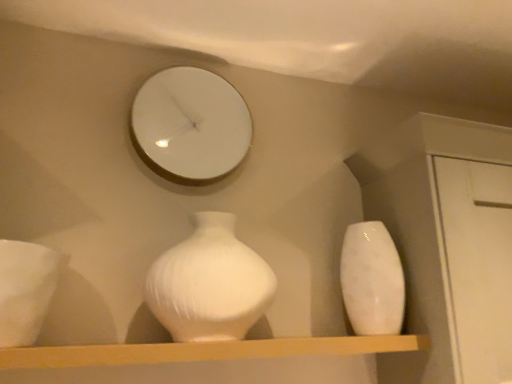
Question: Does smooth wooden shelf at center come behind white glossy vase at right, the second vase viewed from the left?

Choices:
 (A) no
 (B) yes

Answer: (A)

Question: Is smooth wooden shelf at center next to white glossy vase at right, the 1th vase positioned from the right?

Choices:
 (A) no
 (B) yes

Answer: (A)

Question: Is smooth wooden shelf at center facing towards white glossy vase at right, the second vase viewed from the left?

Choices:
 (A) yes
 (B) no

Answer: (B)

Question: From the image's perspective, is smooth wooden shelf at center under white glossy vase at right, the second vase viewed from the left?

Choices:
 (A) yes
 (B) no

Answer: (A)

Question: Is smooth wooden shelf at center outside of white glossy vase at right, the 1th vase positioned from the right?

Choices:
 (A) yes
 (B) no

Answer: (A)

Question: From the image's perspective, is smooth wooden shelf at center on top of white glossy vase at right, the second vase viewed from the left?

Choices:
 (A) yes
 (B) no

Answer: (B)

Question: Is white glossy vase at left not close to white glossy vase at center, marked as the 2th vase in a right-to-left arrangement?

Choices:
 (A) yes
 (B) no

Answer: (B)

Question: Is white glossy vase at left at the left side of white glossy vase at center, arranged as the 1th vase when viewed from the left?

Choices:
 (A) no
 (B) yes

Answer: (B)

Question: Is white glossy vase at left at the right side of white glossy vase at center, arranged as the 1th vase when viewed from the left?

Choices:
 (A) no
 (B) yes

Answer: (A)

Question: From a real-world perspective, is white glossy vase at left under white glossy vase at center, arranged as the 1th vase when viewed from the left?

Choices:
 (A) yes
 (B) no

Answer: (A)

Question: From the image's perspective, is white glossy vase at left under white glossy vase at center, arranged as the 1th vase when viewed from the left?

Choices:
 (A) yes
 (B) no

Answer: (A)

Question: Is the position of white glossy vase at left more distant than that of white glossy vase at center, arranged as the 1th vase when viewed from the left?

Choices:
 (A) no
 (B) yes

Answer: (A)

Question: Is white glossy mirror at upper center turned away from smooth wooden shelf at center?

Choices:
 (A) no
 (B) yes

Answer: (A)